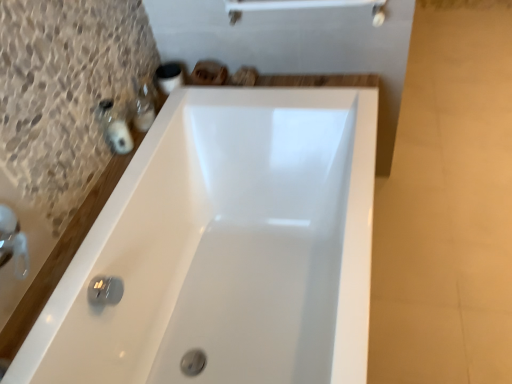
Question: From a real-world perspective, is matte plastic soap dispenser at upper left, arranged as the 1th toiletry when viewed from the back, on top of white glossy bathtub at center?

Choices:
 (A) no
 (B) yes

Answer: (B)

Question: Is matte plastic soap dispenser at upper left, which is the 2th toiletry from front to back, aimed at white glossy bathtub at center?

Choices:
 (A) no
 (B) yes

Answer: (A)

Question: Does matte plastic soap dispenser at upper left, arranged as the 1th toiletry when viewed from the back, appear on the right side of white glossy bathtub at center?

Choices:
 (A) no
 (B) yes

Answer: (A)

Question: From the image's perspective, is matte plastic soap dispenser at upper left, arranged as the 1th toiletry when viewed from the back, on white glossy bathtub at center?

Choices:
 (A) yes
 (B) no

Answer: (A)

Question: Can you confirm if matte plastic soap dispenser at upper left, which is the 2th toiletry from front to back, is smaller than white glossy bathtub at center?

Choices:
 (A) no
 (B) yes

Answer: (B)

Question: Is the surface of matte plastic soap dispenser at upper left, which is the 2th toiletry from front to back, in direct contact with white glossy bathtub at center?

Choices:
 (A) yes
 (B) no

Answer: (B)

Question: Is matte plastic soap dispenser at upper left, arranged as the 1th toiletry when viewed from the back, closer to the viewer compared to matte black soap at left, placed as the 1th toiletry when sorted from front to back?

Choices:
 (A) yes
 (B) no

Answer: (B)

Question: Considering the relative sizes of matte plastic soap dispenser at upper left, arranged as the 1th toiletry when viewed from the back, and matte black soap at left, placed as the 1th toiletry when sorted from front to back, in the image provided, is matte plastic soap dispenser at upper left, arranged as the 1th toiletry when viewed from the back, shorter than matte black soap at left, placed as the 1th toiletry when sorted from front to back,?

Choices:
 (A) yes
 (B) no

Answer: (A)

Question: Considering the relative sizes of matte plastic soap dispenser at upper left, which is the 2th toiletry from front to back, and matte black soap at left, placed as the 1th toiletry when sorted from front to back, in the image provided, is matte plastic soap dispenser at upper left, which is the 2th toiletry from front to back, thinner than matte black soap at left, placed as the 1th toiletry when sorted from front to back,?

Choices:
 (A) yes
 (B) no

Answer: (B)

Question: From the image's perspective, is matte plastic soap dispenser at upper left, which is the 2th toiletry from front to back, beneath matte black soap at left, the 2th toiletry when ordered from back to front?

Choices:
 (A) no
 (B) yes

Answer: (A)

Question: Does matte plastic soap dispenser at upper left, which is the 2th toiletry from front to back, have a larger size compared to matte black soap at left, placed as the 1th toiletry when sorted from front to back?

Choices:
 (A) no
 (B) yes

Answer: (B)

Question: Considering the relative sizes of matte plastic soap dispenser at upper left, which is the 2th toiletry from front to back, and matte black soap at left, the 2th toiletry when ordered from back to front, in the image provided, is matte plastic soap dispenser at upper left, which is the 2th toiletry from front to back, wider than matte black soap at left, the 2th toiletry when ordered from back to front,?

Choices:
 (A) yes
 (B) no

Answer: (A)

Question: Considering the relative positions of matte black soap at left, placed as the 1th toiletry when sorted from front to back, and white glossy bathtub at center in the image provided, is matte black soap at left, placed as the 1th toiletry when sorted from front to back, to the right of white glossy bathtub at center from the viewer's perspective?

Choices:
 (A) no
 (B) yes

Answer: (A)